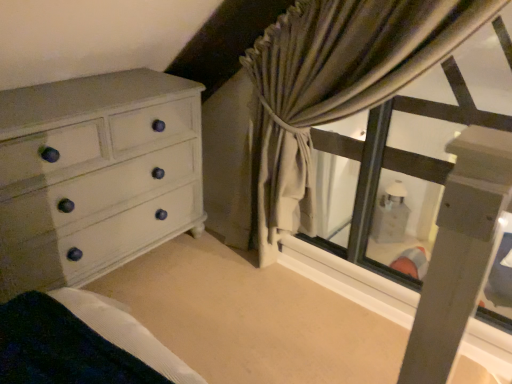
You are a GUI agent. You are given a task and a screenshot of the screen. Output one action in this format:
    pyautogui.click(x=<x>, y=<y>)
    Task: Click on the empty space that is ontop of white painted wood chest of drawers at left (from a real-world perspective)
    The width and height of the screenshot is (512, 384).
    Given the screenshot: What is the action you would take?
    pyautogui.click(x=80, y=96)